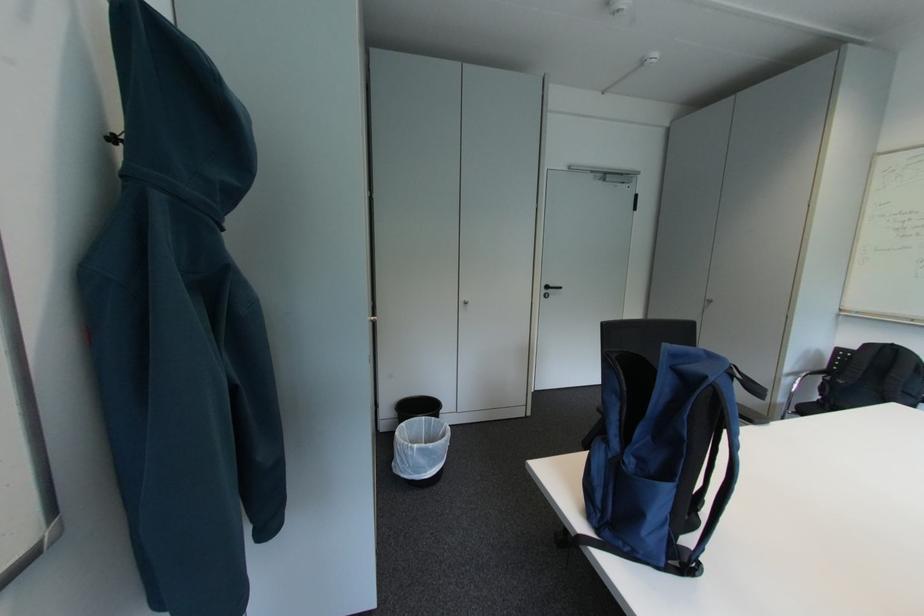
What do you see at coordinates (464, 302) in the screenshot? I see `the silver cabinet lock` at bounding box center [464, 302].